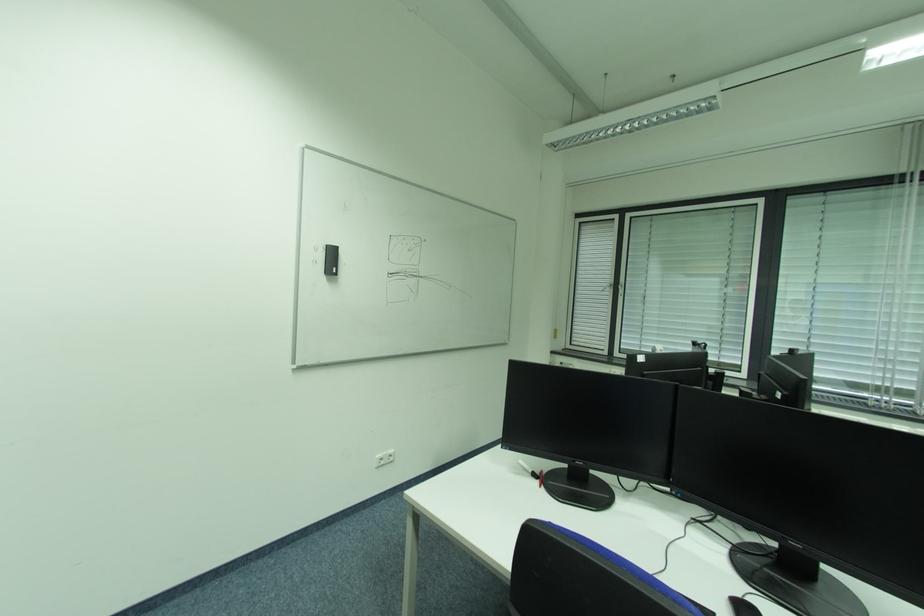
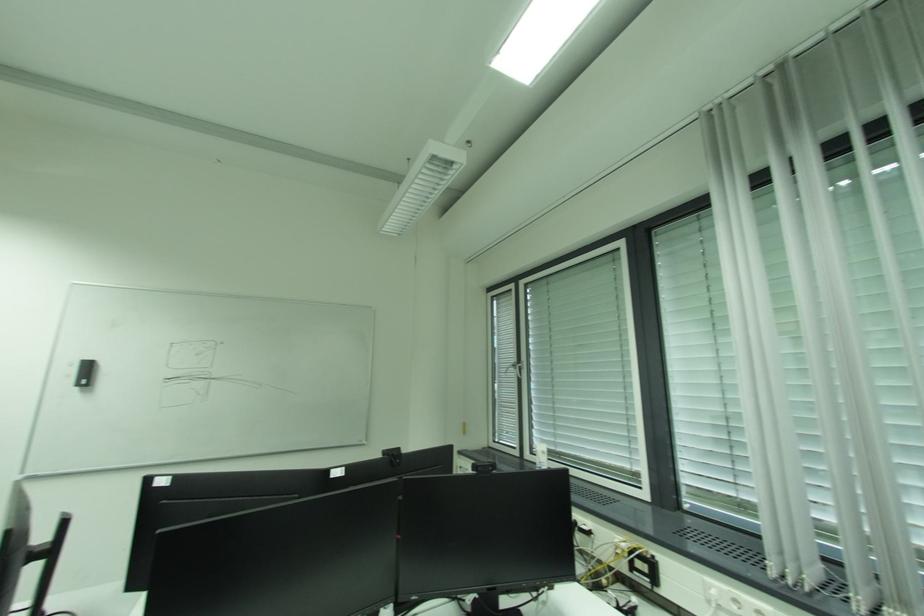
Question: In a continuous first-person perspective shot, in which direction is the camera moving?

Choices:
 (A) Left
 (B) Right
 (C) Forward
 (D) Backward

Answer: (B)